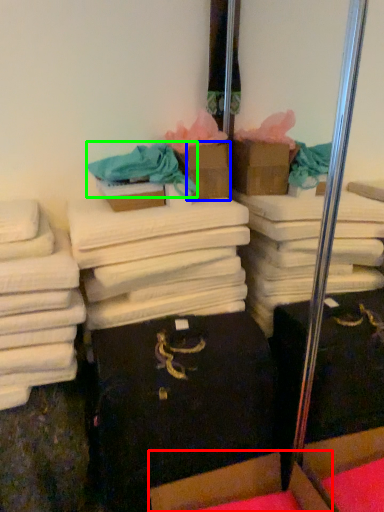
Question: Which object is positioned closest to cardboard box (highlighted by a red box)? Select from cardboard box (highlighted by a blue box) and clothing (highlighted by a green box).

Choices:
 (A) cardboard box
 (B) clothing

Answer: (A)